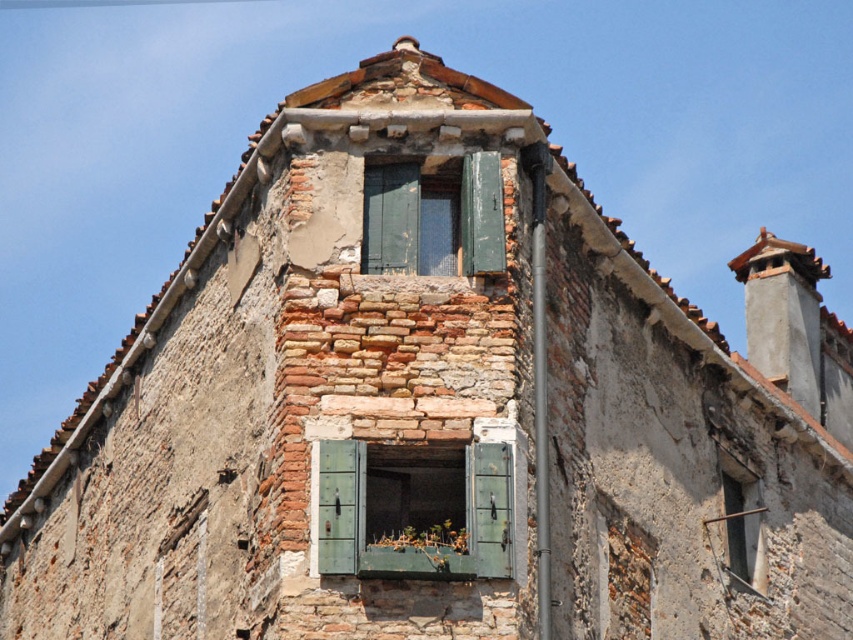
Question: Which point is closer to the camera taking this photo?

Choices:
 (A) (473, 570)
 (B) (457, 209)

Answer: (A)

Question: Does green painted wood at center have a lesser width compared to green wooden window at upper center?

Choices:
 (A) no
 (B) yes

Answer: (A)

Question: Does green painted wood at center lie in front of green wooden window at upper center?

Choices:
 (A) yes
 (B) no

Answer: (A)

Question: Can you confirm if green painted wood at center is thinner than green wooden window at upper center?

Choices:
 (A) yes
 (B) no

Answer: (B)